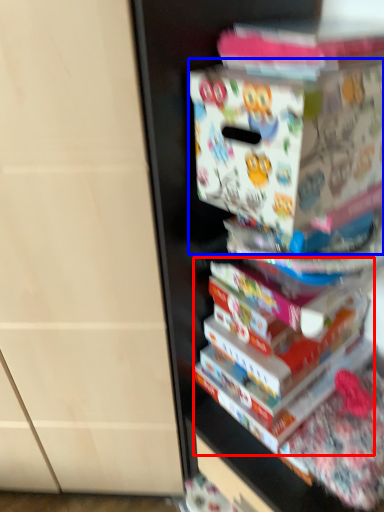
Question: Which of the following is the farthest to the observer, book (highlighted by a red box) or paperback book (highlighted by a blue box)?

Choices:
 (A) book
 (B) paperback book

Answer: (A)